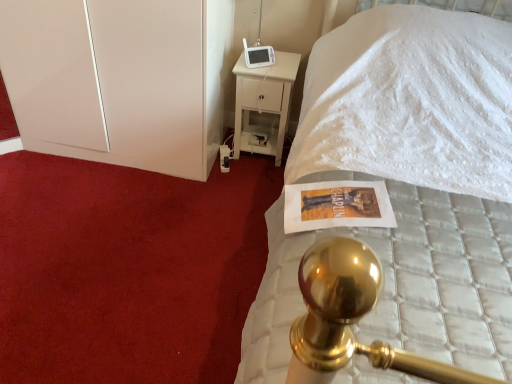
Question: From a real-world perspective, is white glossy dresser at left below white quilted mattress at upper right?

Choices:
 (A) yes
 (B) no

Answer: (A)

Question: Does white glossy dresser at left lie in front of white quilted mattress at upper right?

Choices:
 (A) yes
 (B) no

Answer: (B)

Question: Are white glossy dresser at left and white quilted mattress at upper right far apart?

Choices:
 (A) no
 (B) yes

Answer: (B)

Question: From the image's perspective, is white glossy dresser at left located beneath white quilted mattress at upper right?

Choices:
 (A) no
 (B) yes

Answer: (A)

Question: Is white glossy dresser at left smaller than white quilted mattress at upper right?

Choices:
 (A) no
 (B) yes

Answer: (B)

Question: Is white glossy dresser at left at the left side of white quilted mattress at upper right?

Choices:
 (A) no
 (B) yes

Answer: (B)

Question: Can you confirm if white quilted mattress at upper right is shorter than white glossy dresser at left?

Choices:
 (A) no
 (B) yes

Answer: (A)

Question: Can you confirm if white quilted mattress at upper right is wider than white glossy dresser at left?

Choices:
 (A) no
 (B) yes

Answer: (B)

Question: Is white quilted mattress at upper right closer to camera compared to white glossy dresser at left?

Choices:
 (A) yes
 (B) no

Answer: (A)

Question: Would you say white quilted mattress at upper right is outside white glossy dresser at left?

Choices:
 (A) no
 (B) yes

Answer: (B)

Question: Is the position of white quilted mattress at upper right more distant than that of white glossy dresser at left?

Choices:
 (A) no
 (B) yes

Answer: (A)

Question: Is white quilted mattress at upper right looking in the opposite direction of white glossy dresser at left?

Choices:
 (A) yes
 (B) no

Answer: (B)

Question: Based on their positions, is white quilted mattress at upper right located to the left or right of white glossy dresser at left?

Choices:
 (A) right
 (B) left

Answer: (A)